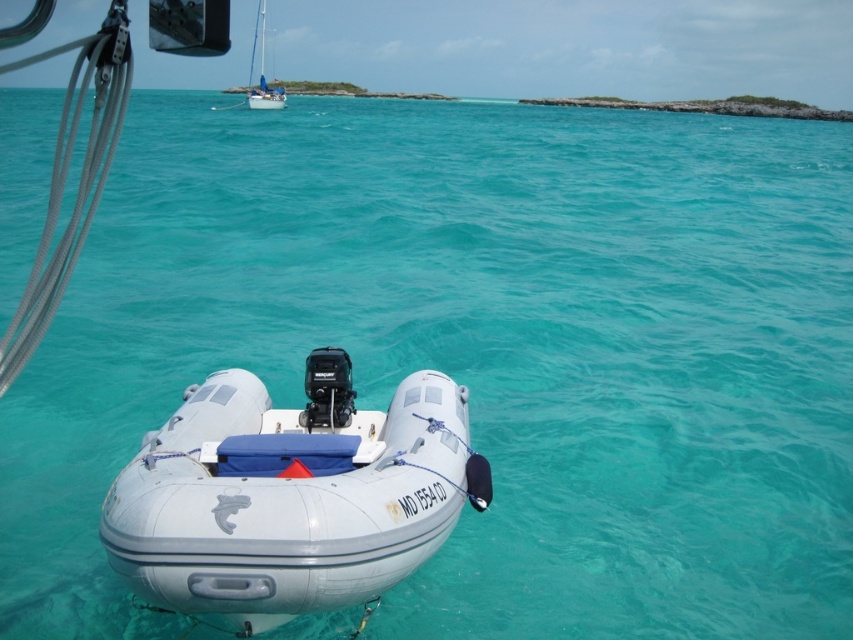
Can you confirm if white rubber dinghy at center is positioned above white glossy sailboat at upper center?

No.

Is white rubber dinghy at center taller than white glossy sailboat at upper center?

No, white rubber dinghy at center is not taller than white glossy sailboat at upper center.

This screenshot has width=853, height=640. What do you see at coordinates (291, 493) in the screenshot?
I see `white rubber dinghy at center` at bounding box center [291, 493].

Find the location of `white rubber dinghy at center`. white rubber dinghy at center is located at coordinates (291, 493).